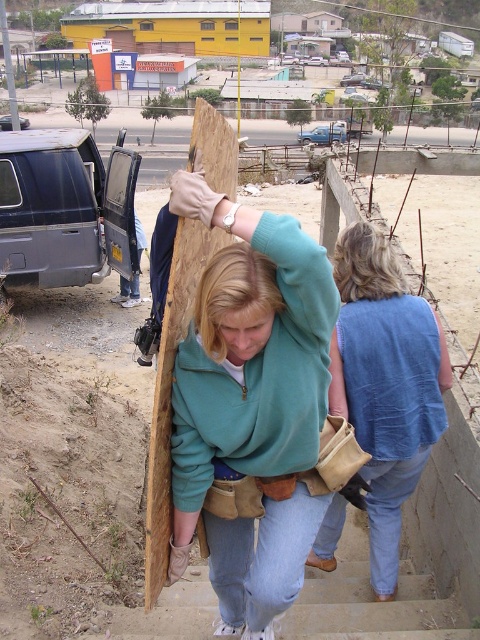
You are a safety inspector at the construction site. You need to check the distance between the blue knitted vest at upper right and the camera to ensure compliance with safety regulations. The regulation states that safety equipment must be within 3 meters of each other. Is the distance compliant?

The blue knitted vest at upper right and the camera are 2.71 meters apart from each other, which is within the 3 meters regulation. Therefore, the distance is compliant.

You are an observer at the construction site. You see the teal fleece sweatshirt at center and the blue knitted vest at upper right. Which one is positioned more to the left side of the scene?

The teal fleece sweatshirt at center is positioned more to the left side of the scene than the blue knitted vest at upper right.